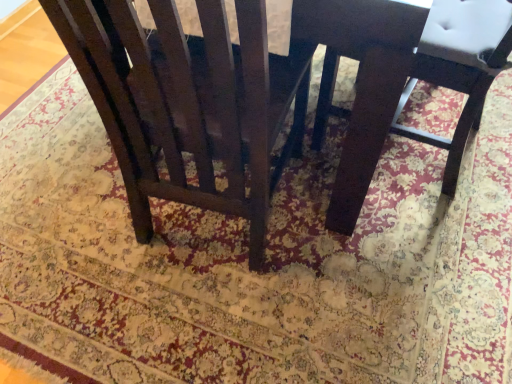
Question: Is matte dark wood chair at center, marked as the 2th chair in a left-to-right arrangement, facing towards matte dark wood chair at center, positioned as the second chair in right-to-left order?

Choices:
 (A) no
 (B) yes

Answer: (A)

Question: Is matte dark wood chair at center, marked as the first chair in a right-to-left arrangement, positioned with its back to matte dark wood chair at center, positioned as the second chair in right-to-left order?

Choices:
 (A) yes
 (B) no

Answer: (B)

Question: Can you confirm if matte dark wood chair at center, marked as the first chair in a right-to-left arrangement, is taller than matte dark wood chair at center, the first chair in the left-to-right sequence?

Choices:
 (A) yes
 (B) no

Answer: (B)

Question: Does matte dark wood chair at center, marked as the 2th chair in a left-to-right arrangement, have a lesser width compared to matte dark wood chair at center, the first chair in the left-to-right sequence?

Choices:
 (A) no
 (B) yes

Answer: (A)

Question: Can matte dark wood chair at center, positioned as the second chair in right-to-left order, be found inside matte dark wood chair at center, marked as the 2th chair in a left-to-right arrangement?

Choices:
 (A) yes
 (B) no

Answer: (B)

Question: In the image, is matte dark wood chair at center, marked as the 2th chair in a left-to-right arrangement, on the left side or the right side of dark wood chair at center?

Choices:
 (A) left
 (B) right

Answer: (B)

Question: Which is correct: matte dark wood chair at center, marked as the 2th chair in a left-to-right arrangement, is inside dark wood chair at center, or outside of it?

Choices:
 (A) inside
 (B) outside

Answer: (A)

Question: Is matte dark wood chair at center, marked as the first chair in a right-to-left arrangement, taller or shorter than dark wood chair at center?

Choices:
 (A) short
 (B) tall

Answer: (A)

Question: Looking at the image, does matte dark wood chair at center, marked as the first chair in a right-to-left arrangement, seem bigger or smaller compared to dark wood chair at center?

Choices:
 (A) small
 (B) big

Answer: (A)

Question: Is dark wood chair at center inside or outside of matte dark wood chair at center, marked as the 2th chair in a left-to-right arrangement?

Choices:
 (A) outside
 (B) inside

Answer: (A)

Question: In terms of size, does dark wood chair at center appear bigger or smaller than matte dark wood chair at center, marked as the 2th chair in a left-to-right arrangement?

Choices:
 (A) small
 (B) big

Answer: (B)

Question: Would you say dark wood chair at center is to the left or to the right of matte dark wood chair at center, marked as the 2th chair in a left-to-right arrangement, in the picture?

Choices:
 (A) left
 (B) right

Answer: (A)

Question: In terms of width, does dark wood chair at center look wider or thinner when compared to matte dark wood chair at center, marked as the first chair in a right-to-left arrangement?

Choices:
 (A) thin
 (B) wide

Answer: (B)

Question: In the image, is matte dark wood chair at center, marked as the first chair in a right-to-left arrangement, positioned in front of or behind matte dark wood chair at center, positioned as the second chair in right-to-left order?

Choices:
 (A) front
 (B) behind

Answer: (B)

Question: In terms of width, does matte dark wood chair at center, marked as the first chair in a right-to-left arrangement, look wider or thinner when compared to matte dark wood chair at center, positioned as the second chair in right-to-left order?

Choices:
 (A) thin
 (B) wide

Answer: (B)